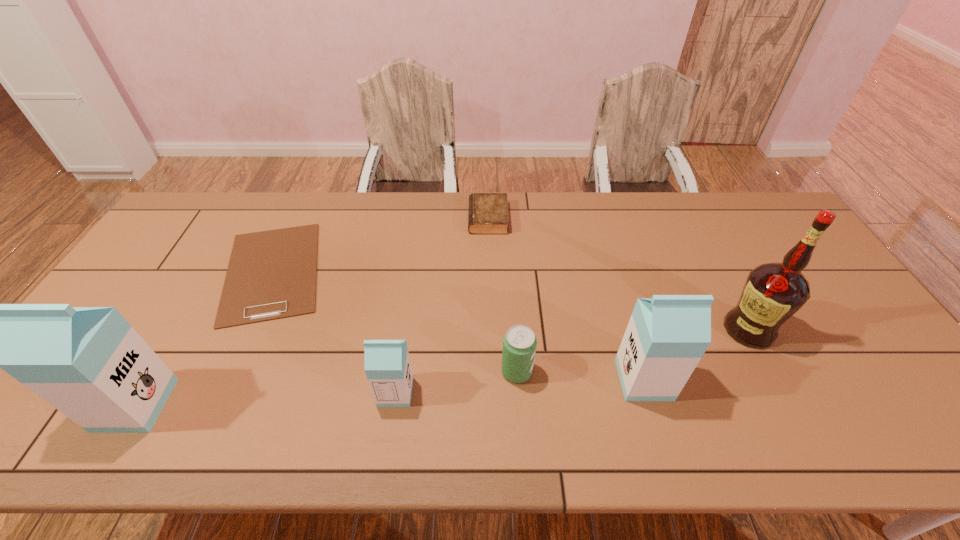
The width and height of the screenshot is (960, 540). In order to click on free space located on the left of the second milk carton from left to right in this screenshot , I will do `click(278, 392)`.

I want to click on vacant space situated 0.070m on the left of the second shortest milk carton, so click(x=591, y=380).

The image size is (960, 540). Identify the location of vacant space located 0.140m on the spine side of the sixth tallest object. coord(427,219).

What are the coordinates of `blank space located on the spine side of the sixth tallest object` in the screenshot? It's located at (404, 219).

Where is `vacant position located on the spine side of the sixth tallest object`? This screenshot has width=960, height=540. vacant position located on the spine side of the sixth tallest object is located at coordinates (436, 219).

You are a GUI agent. You are given a task and a screenshot of the screen. Output one action in this format:
    pyautogui.click(x=<x>, y=<y>)
    Task: Click on the free space located on the label of the alcohol
    This screenshot has width=960, height=540.
    Given the screenshot: What is the action you would take?
    pyautogui.click(x=645, y=330)

This screenshot has height=540, width=960. What are the coordinates of `vacant space located 0.390m on the label of the alcohol` in the screenshot? It's located at (577, 330).

The width and height of the screenshot is (960, 540). I want to click on free space located on the label of the alcohol, so click(x=600, y=330).

Locate an element on the screen. Image resolution: width=960 pixels, height=540 pixels. vacant space located 0.110m on the left of the clipboard is located at coordinates (180, 272).

Identify the location of vacant space located on the back of the third shortest object. Image resolution: width=960 pixels, height=540 pixels. (515, 333).